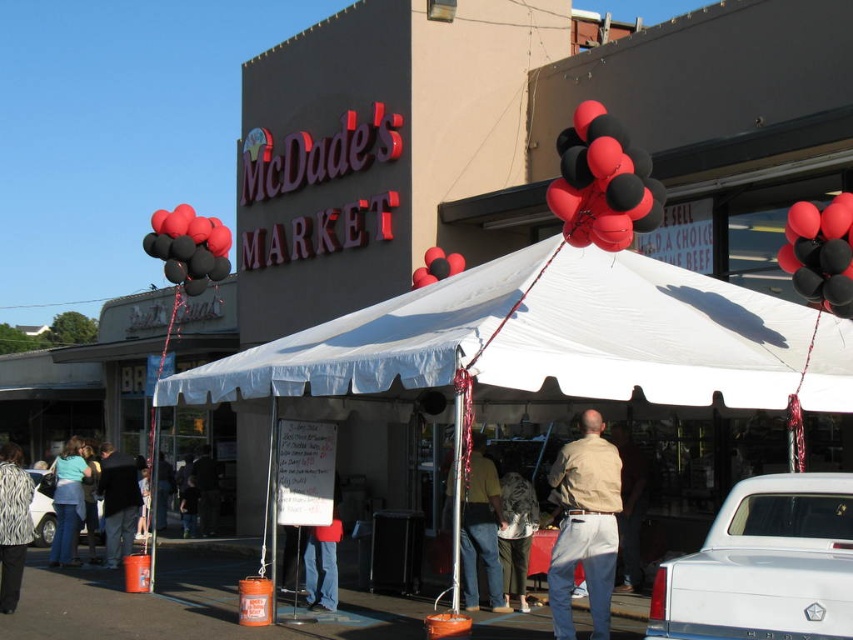
Question: Can you confirm if black matte balloons at upper center is positioned to the right of black matte balloons at upper right?

Choices:
 (A) no
 (B) yes

Answer: (A)

Question: Can you confirm if white fabric tent at center is wider than white glossy car at lower left?

Choices:
 (A) no
 (B) yes

Answer: (A)

Question: Which object is the farthest from the white glossy pickup truck at lower right?

Choices:
 (A) white fabric tent at center
 (B) black matte balloons at upper center

Answer: (B)

Question: Which of the following is the farthest from the observer?

Choices:
 (A) (61, 538)
 (B) (166, 214)
 (C) (105, 461)

Answer: (A)

Question: Is white fabric tent at center below yellow shirt at center?

Choices:
 (A) no
 (B) yes

Answer: (A)

Question: Among these objects, which one is nearest to the camera?

Choices:
 (A) black matte balloons at upper right
 (B) white glossy pickup truck at lower right
 (C) white glossy car at lower left

Answer: (B)